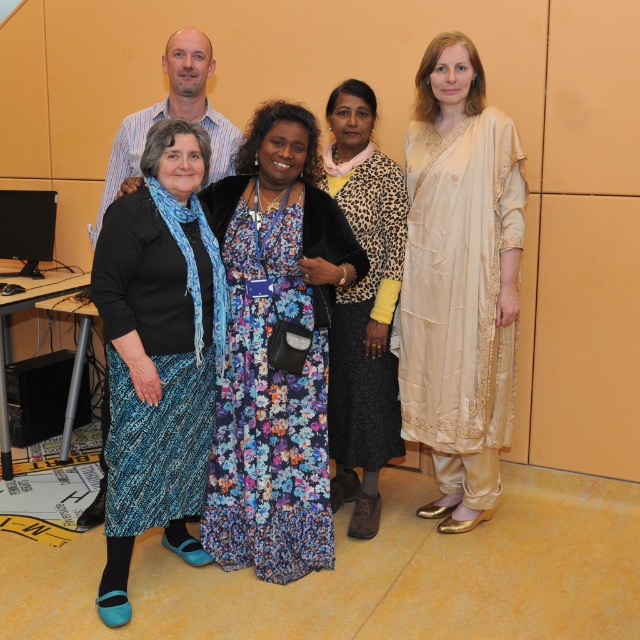
Looking at this image, between floral dress at center and leopard print jacket at center, which one has less height?

Standing shorter between the two is floral dress at center.

Which is in front, point (348, 244) or point (365, 243)?

Point (348, 244) is in front.

What do you see at coordinates (268, 349) in the screenshot? Image resolution: width=640 pixels, height=640 pixels. I see `floral dress at center` at bounding box center [268, 349].

What are the coordinates of `floral dress at center` in the screenshot? It's located at (268, 349).

Is cream satin kurta at right to the left of blue textured skirt at lower left from the viewer's perspective?

No, cream satin kurta at right is not to the left of blue textured skirt at lower left.

Between point (500, 308) and point (154, 131), which one is positioned behind?

Point (500, 308)

This screenshot has width=640, height=640. What are the coordinates of `cream satin kurta at right` in the screenshot? It's located at (460, 280).

Is point (269, 410) behind point (148, 444)?

Yes, it is.

Where is `floral dress at center`? This screenshot has height=640, width=640. floral dress at center is located at coordinates (268, 349).